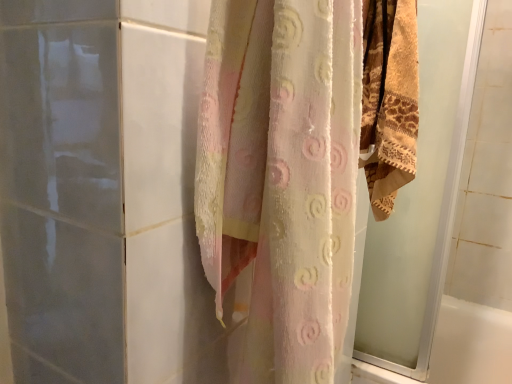
You are a GUI agent. You are given a task and a screenshot of the screen. Output one action in this format:
    pyautogui.click(x=<x>, y=<y>)
    Task: Click on the beige textured towel at right
    The width and height of the screenshot is (512, 384).
    Given the screenshot: What is the action you would take?
    pyautogui.click(x=422, y=200)

What do you see at coordinates (422, 200) in the screenshot?
I see `beige textured towel at right` at bounding box center [422, 200].

What is the approximate width of translucent floral curtain at center?

7.03 inches.

The image size is (512, 384). Find the location of `translucent floral curtain at center`. translucent floral curtain at center is located at coordinates (282, 175).

Describe the element at coordinates (282, 175) in the screenshot. Image resolution: width=512 pixels, height=384 pixels. I see `translucent floral curtain at center` at that location.

Find the location of a particular element. beige textured towel at right is located at coordinates (422, 200).

Is translucent floral curtain at center to the left or to the right of beige textured towel at right in the image?

In the image, translucent floral curtain at center appears on the left side of beige textured towel at right.

Does translucent floral curtain at center come behind beige textured towel at right?

That is False.

Is point (264, 36) in front of point (356, 333)?

Yes, it is in front of point (356, 333).

From the image's perspective, between translucent floral curtain at center and beige textured towel at right, which one is located above?

beige textured towel at right appears higher in the image.

From a real-world perspective, who is located lower, translucent floral curtain at center or beige textured towel at right?

translucent floral curtain at center is physically lower.

Is translucent floral curtain at center thinner than beige textured towel at right?

No, translucent floral curtain at center is not thinner than beige textured towel at right.

Who is taller, translucent floral curtain at center or beige textured towel at right?

With more height is translucent floral curtain at center.

Which of these two, translucent floral curtain at center or beige textured towel at right, is smaller?

Smaller between the two is beige textured towel at right.

Is beige textured towel at right completely or partially inside translucent floral curtain at center?

No, beige textured towel at right is not surrounded by translucent floral curtain at center.

Is translucent floral curtain at center positioned far away from beige textured towel at right?

That's not correct — translucent floral curtain at center is a little close to beige textured towel at right.

Is beige textured towel at right at the back of translucent floral curtain at center?

No.

How many degrees apart are the facing directions of translucent floral curtain at center and beige textured towel at right?

The angle between the facing direction of translucent floral curtain at center and the facing direction of beige textured towel at right is 1.23 degrees.

Measure the distance between translucent floral curtain at center and beige textured towel at right.

They are 29.55 inches apart.

Locate an element on the screen. screen door positioned vertically above the translucent floral curtain at center (from a real-world perspective) is located at coordinates click(x=422, y=200).

Is beige textured towel at right to the left or to the right of translucent floral curtain at center in the image?

Clearly, beige textured towel at right is on the right of translucent floral curtain at center in the image.

Which object is more forward, beige textured towel at right or translucent floral curtain at center?

translucent floral curtain at center is closer to the camera.

Does point (429, 70) appear closer or farther from the camera than point (260, 270)?

Point (429, 70).

From the image's perspective, which is below, beige textured towel at right or translucent floral curtain at center?

translucent floral curtain at center is shown below in the image.

Looking at this image, from a real-world perspective, is beige textured towel at right located beneath translucent floral curtain at center?

No, from a real-world perspective, beige textured towel at right is not beneath translucent floral curtain at center.

Considering the sizes of objects beige textured towel at right and translucent floral curtain at center in the image provided, who is thinner, beige textured towel at right or translucent floral curtain at center?

Thinner between the two is beige textured towel at right.

Considering the relative sizes of beige textured towel at right and translucent floral curtain at center in the image provided, is beige textured towel at right shorter than translucent floral curtain at center?

Yes, beige textured towel at right is shorter than translucent floral curtain at center.

Is beige textured towel at right smaller than translucent floral curtain at center?

Yes.

Is beige textured towel at right inside the boundaries of translucent floral curtain at center, or outside?

beige textured towel at right is spatially situated outside translucent floral curtain at center.

Is beige textured towel at right far from translucent floral curtain at center?

Actually, beige textured towel at right and translucent floral curtain at center are a little close together.

Could you tell me if beige textured towel at right is turned towards translucent floral curtain at center?

No.

Locate an element on the screen. The height and width of the screenshot is (384, 512). screen door above the translucent floral curtain at center (from the image's perspective) is located at coordinates (422, 200).

There is a translucent floral curtain at center. Identify the location of screen door above it (from a real-world perspective). The image size is (512, 384). (422, 200).

This screenshot has height=384, width=512. In order to click on curtain in front of the beige textured towel at right in this screenshot , I will do (x=282, y=175).